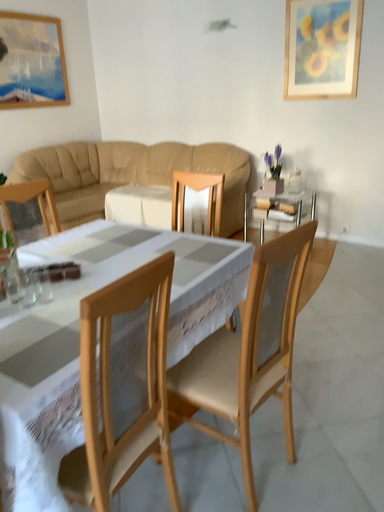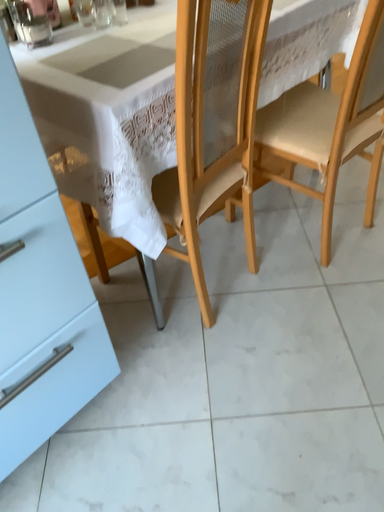
Question: How did the camera likely rotate when shooting the video?

Choices:
 (A) rotated downward
 (B) rotated upward

Answer: (A)